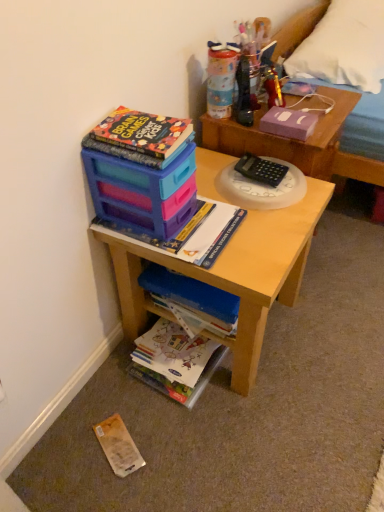
This screenshot has width=384, height=512. What are the coordinates of `free area in between matte plastic desk at center and yellow paper at lower left, positioned as the 1th paperback book in left-to-right order` in the screenshot? It's located at (147, 408).